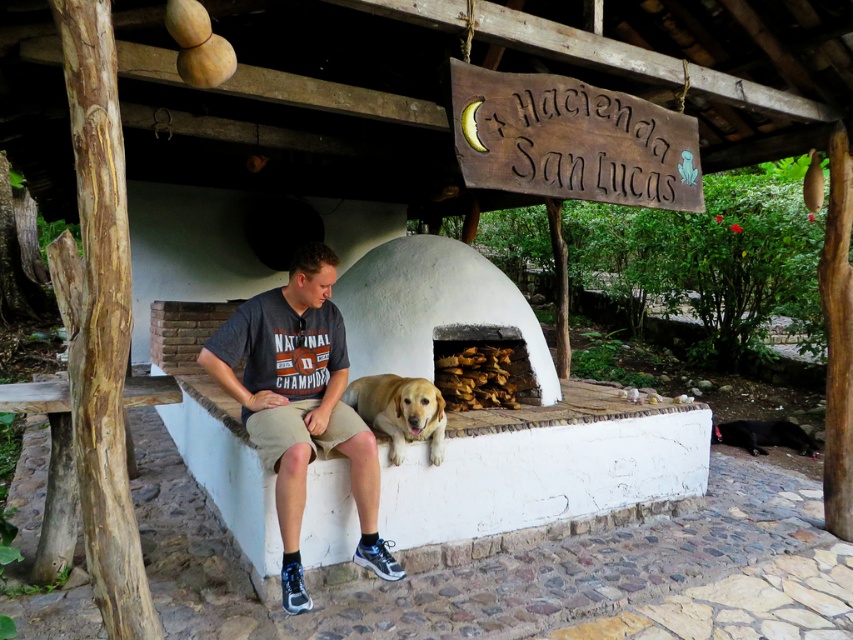
Question: In this image, where is golden fur dog at center located relative to black fur dog at lower right?

Choices:
 (A) right
 (B) left

Answer: (B)

Question: Which point is closer to the camera?

Choices:
 (A) (329, 426)
 (B) (350, 390)

Answer: (A)

Question: Estimate the real-world distances between objects in this image. Which object is farther from the dark gray t-shirt at center?

Choices:
 (A) golden fur dog at center
 (B) black fur dog at lower right

Answer: (B)

Question: Is dark gray t-shirt at center bigger than golden fur dog at center?

Choices:
 (A) yes
 (B) no

Answer: (A)

Question: Can you confirm if golden fur dog at center is thinner than black fur dog at lower right?

Choices:
 (A) no
 (B) yes

Answer: (B)

Question: Among these points, which one is farthest from the camera?

Choices:
 (A) (775, 432)
 (B) (407, 394)
 (C) (248, 356)

Answer: (A)